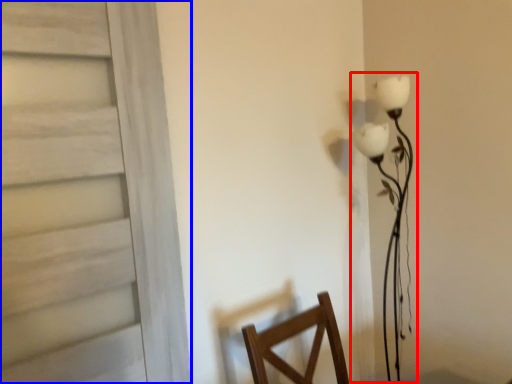
Question: Which object appears closest to the camera in this image, table lamp (highlighted by a red box) or door (highlighted by a blue box)?

Choices:
 (A) table lamp
 (B) door

Answer: (B)